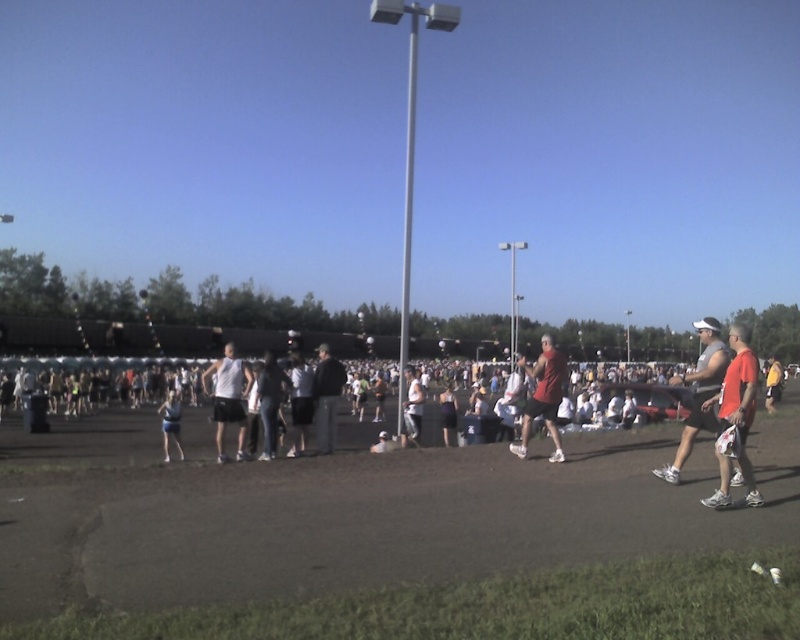
Is red matte shirt at right to the right of white tank top at center from the viewer's perspective?

Correct, you'll find red matte shirt at right to the right of white tank top at center.

Can you confirm if red matte shirt at right is smaller than white tank top at center?

Yes.

Image resolution: width=800 pixels, height=640 pixels. What do you see at coordinates (736, 419) in the screenshot?
I see `red matte shirt at right` at bounding box center [736, 419].

Locate an element on the screen. Image resolution: width=800 pixels, height=640 pixels. red matte shirt at right is located at coordinates (736, 419).

Can you confirm if white matte tank top at center is thinner than yellow fabric shirt at right?

Indeed, white matte tank top at center has a lesser width compared to yellow fabric shirt at right.

Which of these two, white matte tank top at center or yellow fabric shirt at right, stands shorter?

With less height is yellow fabric shirt at right.

This screenshot has width=800, height=640. In order to click on white matte tank top at center in this screenshot , I will do `click(228, 397)`.

At what (x,y) coordinates should I click in order to perform the action: click on white matte tank top at center. Please return your answer as a coordinate pair (x, y). The image size is (800, 640). Looking at the image, I should click on (228, 397).

Is the position of light blue fabric shorts at center more distant than that of dark gray tank top at center?

No, light blue fabric shorts at center is in front of dark gray tank top at center.

Does point (173, 424) come behind point (454, 406)?

No, it is in front of (454, 406).

Where is `light blue fabric shorts at center`? The width and height of the screenshot is (800, 640). light blue fabric shorts at center is located at coordinates [170, 422].